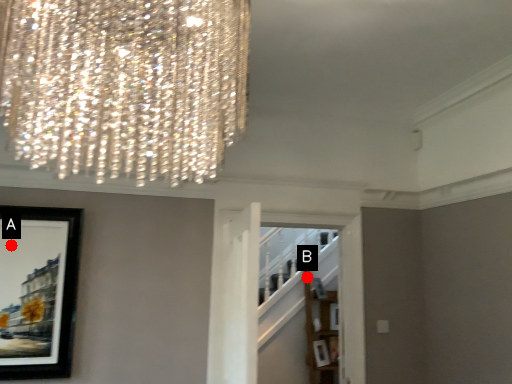
Question: Two points are circled on the image, labeled by A and B beside each circle. Which point is closer to the camera?

Choices:
 (A) A is closer
 (B) B is closer

Answer: (A)